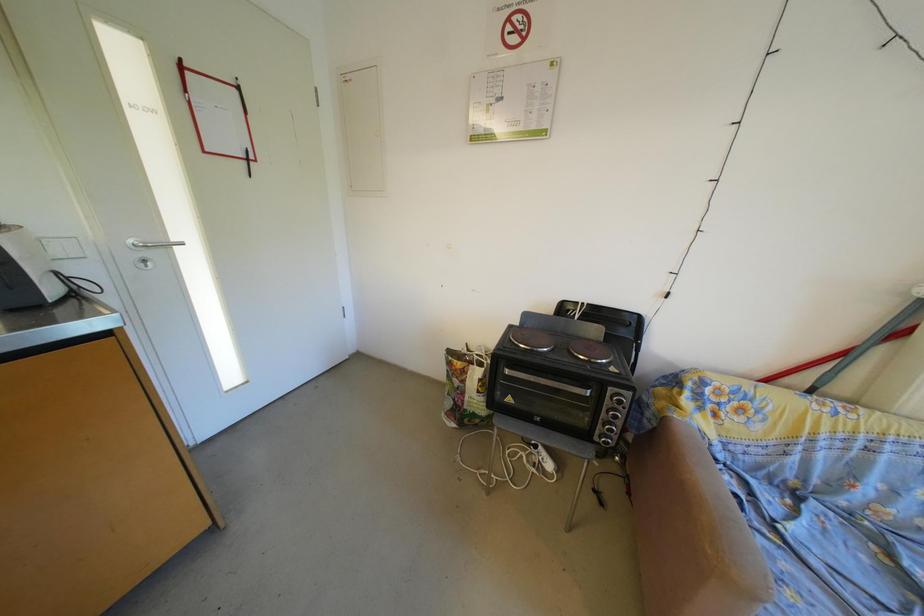
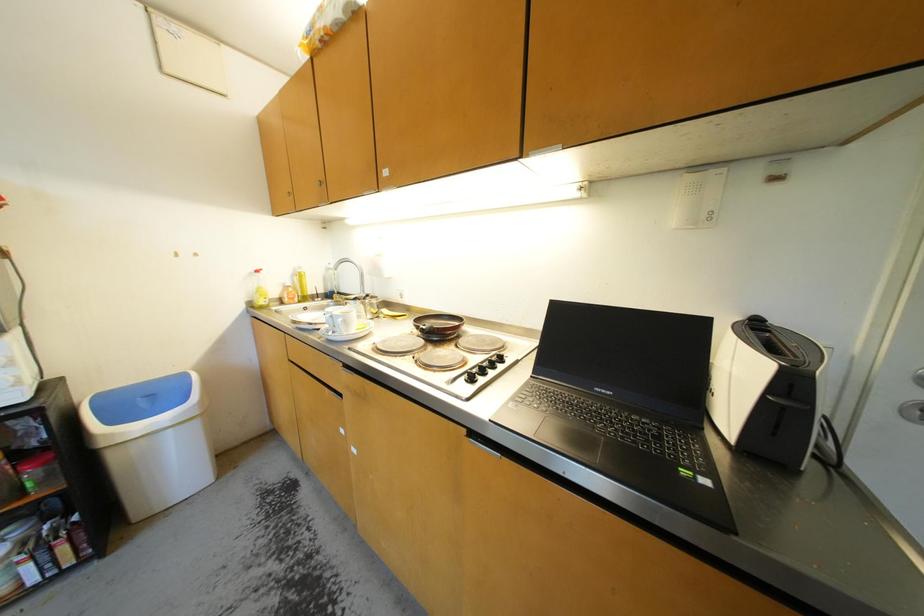
Question: The camera is either moving clockwise (left) or counter-clockwise (right) around the object. The first image is from the beginning of the video and the second image is from the end. Is the camera moving left or right when shooting the video?

Choices:
 (A) Left
 (B) Right

Answer: (B)